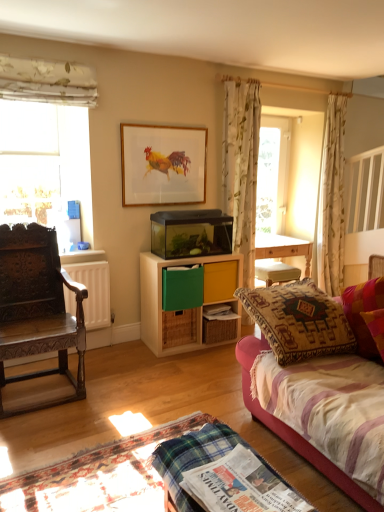
Question: Which direction should I rotate to face yellow matte drawer at center, which is the first drawer from top to bottom, — up or down?

Choices:
 (A) down
 (B) up

Answer: (A)

Question: In which direction should I rotate to look at green matte drawer at center, the 2th drawer ordered from the bottom?

Choices:
 (A) left
 (B) right

Answer: (A)

Question: Can you confirm if carved wood chair at left is taller than velvet pink pillow at right?

Choices:
 (A) no
 (B) yes

Answer: (B)

Question: Considering the relative positions of carved wood chair at left and velvet pink pillow at right in the image provided, is carved wood chair at left to the left of velvet pink pillow at right from the viewer's perspective?

Choices:
 (A) yes
 (B) no

Answer: (A)

Question: Is carved wood chair at left positioned with its back to velvet pink pillow at right?

Choices:
 (A) no
 (B) yes

Answer: (A)

Question: From a real-world perspective, is carved wood chair at left over velvet pink pillow at right?

Choices:
 (A) yes
 (B) no

Answer: (B)

Question: Is carved wood chair at left far away from velvet pink pillow at right?

Choices:
 (A) yes
 (B) no

Answer: (A)

Question: Is carved wood chair at left with velvet pink pillow at right?

Choices:
 (A) no
 (B) yes

Answer: (A)

Question: Is green matte drawer at center, which appears as the second drawer when viewed from the top, positioned with its back to white floral fabric at upper left, marked as the 1th curtain in a left-to-right arrangement?

Choices:
 (A) yes
 (B) no

Answer: (B)

Question: Is green matte drawer at center, which appears as the second drawer when viewed from the top, bigger than white floral fabric at upper left, placed as the 3th curtain when sorted from back to front?

Choices:
 (A) yes
 (B) no

Answer: (B)

Question: Is green matte drawer at center, the 2th drawer ordered from the bottom, at the right side of white floral fabric at upper left, placed as the 3th curtain when sorted from back to front?

Choices:
 (A) no
 (B) yes

Answer: (B)

Question: Can you confirm if green matte drawer at center, the 2th drawer ordered from the bottom, is taller than white floral fabric at upper left, placed as the 3th curtain when sorted from back to front?

Choices:
 (A) no
 (B) yes

Answer: (B)

Question: Could you tell me if green matte drawer at center, the 2th drawer ordered from the bottom, is facing white floral fabric at upper left, marked as the 1th curtain in a left-to-right arrangement?

Choices:
 (A) no
 (B) yes

Answer: (A)

Question: From a real-world perspective, is green matte drawer at center, the 2th drawer ordered from the bottom, positioned over white floral fabric at upper left, marked as the 1th curtain in a left-to-right arrangement, based on gravity?

Choices:
 (A) yes
 (B) no

Answer: (B)

Question: Is green woven drawer at center, which is counted as the 3th drawer, starting from the top, shorter than floral fabric curtain at center, which is counted as the second curtain, starting from the front?

Choices:
 (A) no
 (B) yes

Answer: (B)